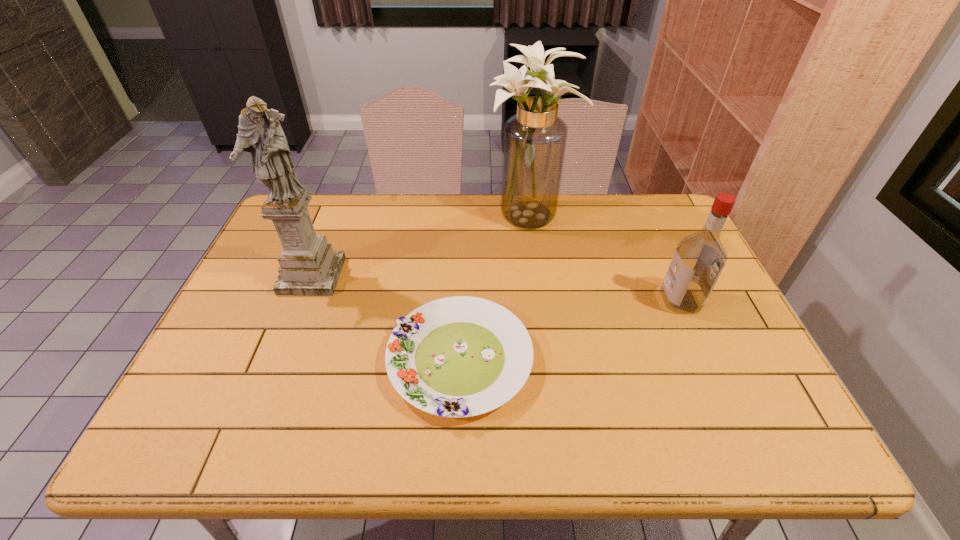
Identify which object is located as the second nearest to the flower arrangement. Please provide its 2D coordinates. Your answer should be formatted as a tuple, i.e. [(x, y)], where the tuple contains the x and y coordinates of a point satisfying the conditions above.

[(699, 258)]

Locate which object is the second closest to the sculpture. Please provide its 2D coordinates. Your answer should be formatted as a tuple, i.e. [(x, y)], where the tuple contains the x and y coordinates of a point satisfying the conditions above.

[(534, 141)]

This screenshot has width=960, height=540. Identify the location of blank area in the image that satisfies the following two spatial constraints: 1. on the front-facing side of the leftmost object; 2. on the right side of the shortest object. (278, 360).